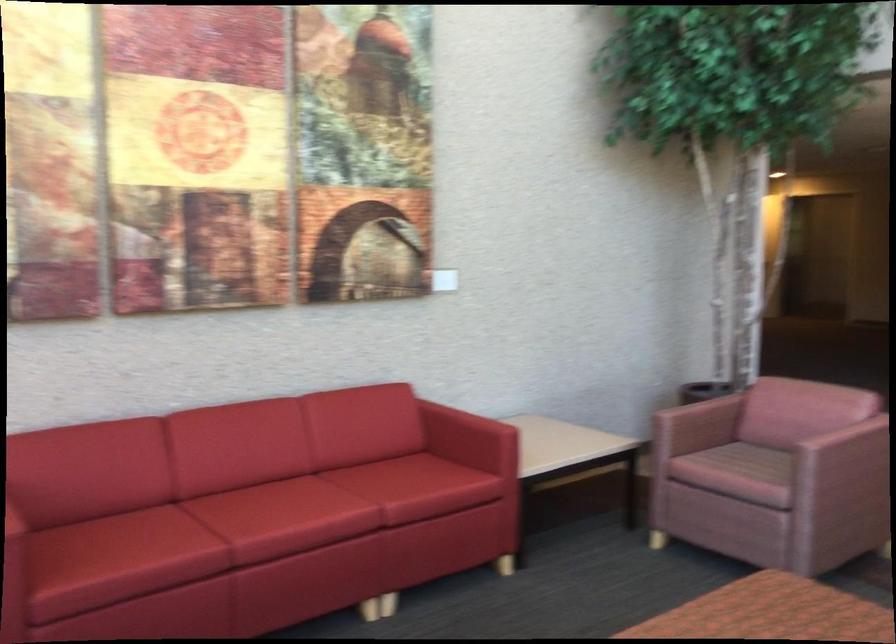
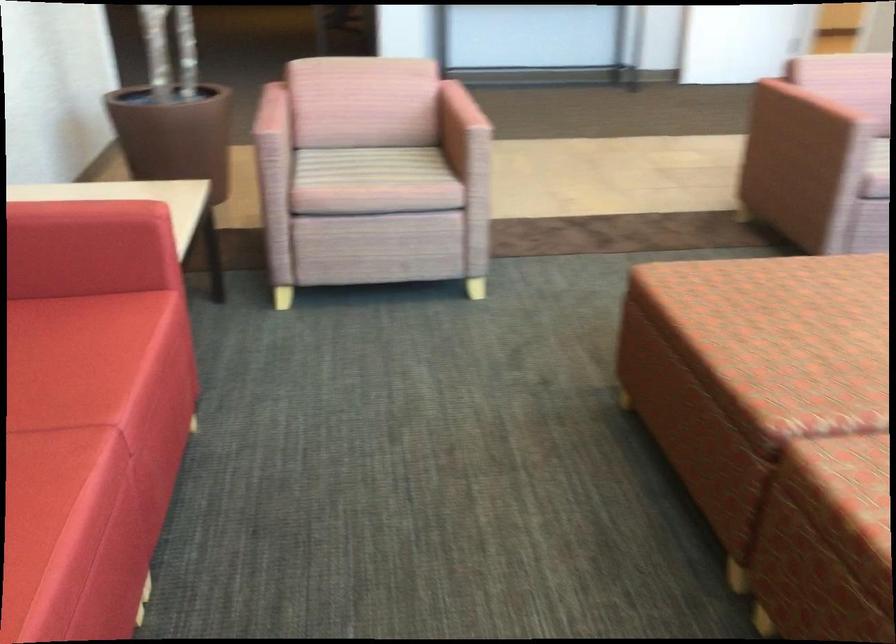
Where in the second image is the point corresponding to [742,456] from the first image?

(365, 166)